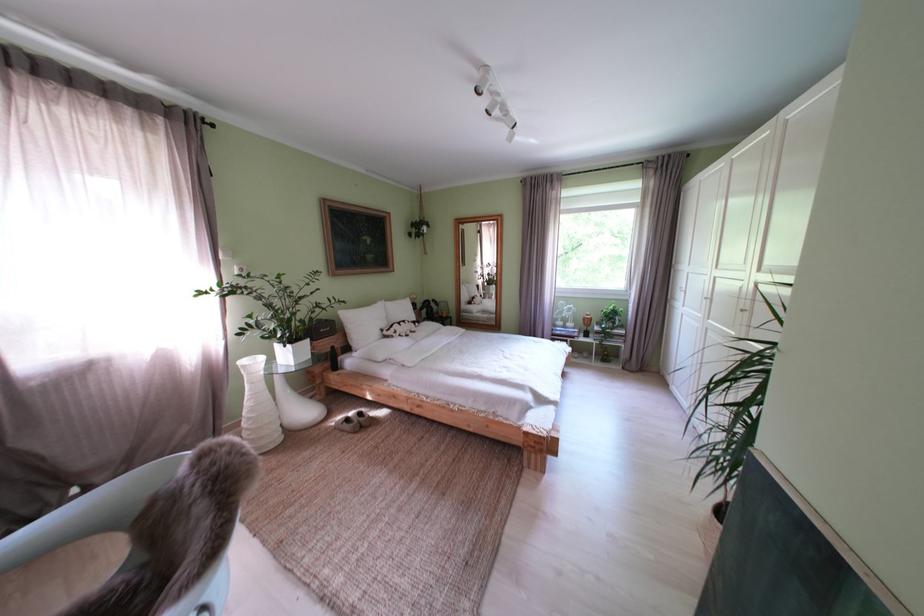
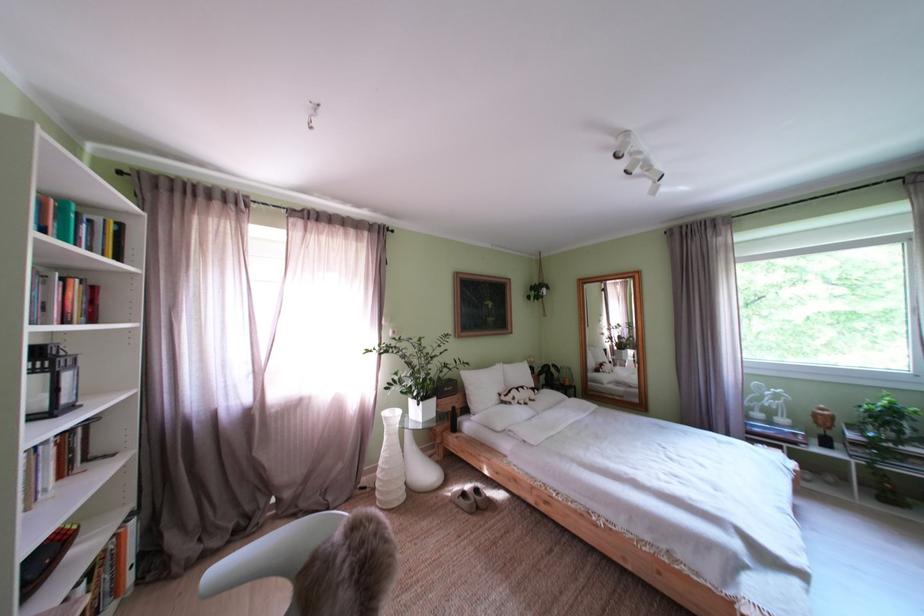
Where in the second image is the point corresponding to (407,338) from the first image?

(525, 405)